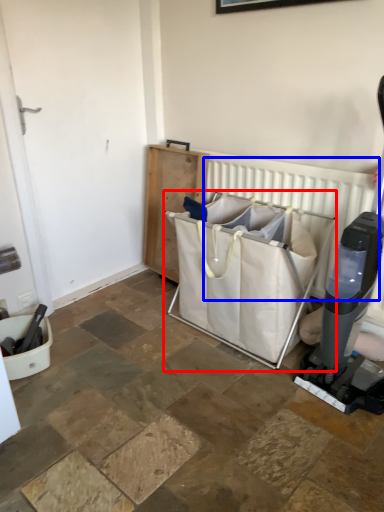
Question: Which object is closer to the camera taking this photo, baby carriage (highlighted by a red box) or radiator (highlighted by a blue box)?

Choices:
 (A) baby carriage
 (B) radiator

Answer: (A)